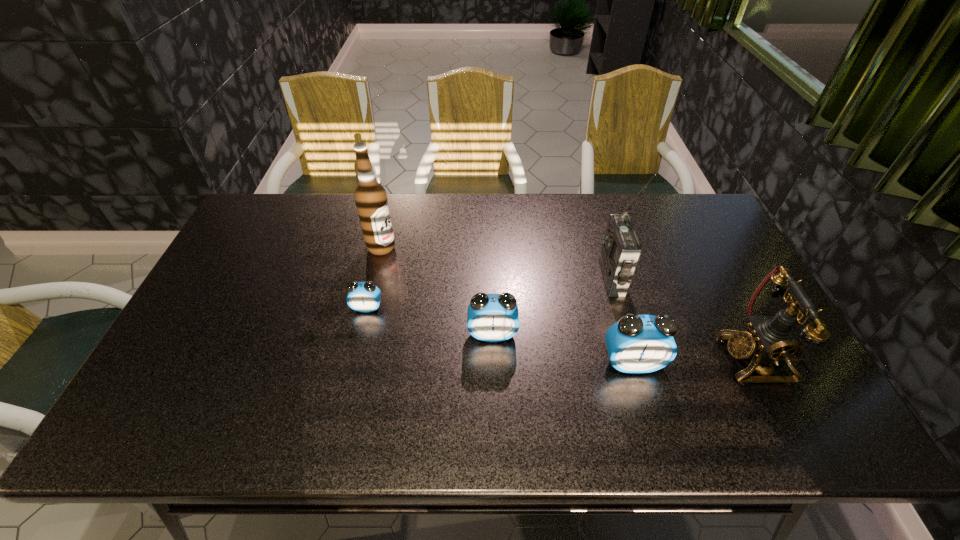
You are a GUI agent. You are given a task and a screenshot of the screen. Output one action in this format:
    pyautogui.click(x=<x>, y=<y>)
    Task: Click on the vacant area that satisfies the following two spatial constraints: 1. on the display of the fifth nearest object; 2. on the face of the nearest alarm clock
    
    Given the screenshot: What is the action you would take?
    pyautogui.click(x=636, y=363)

Find the location of `vacant area in the image that satisfies the following two spatial constraints: 1. on the front of the telephone, featuring the rotary dial; 2. on the face of the nearest alarm clock`. vacant area in the image that satisfies the following two spatial constraints: 1. on the front of the telephone, featuring the rotary dial; 2. on the face of the nearest alarm clock is located at coordinates (756, 363).